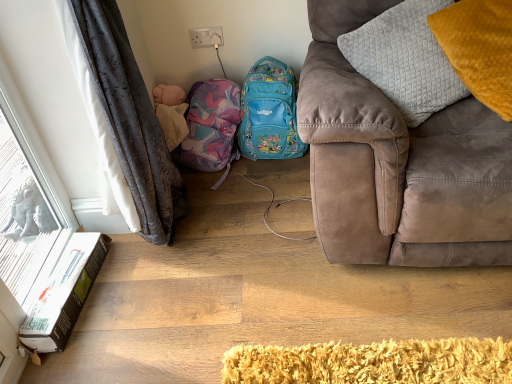
Where is `vacant area in front of white cardboard box at lower left`? The image size is (512, 384). vacant area in front of white cardboard box at lower left is located at coordinates (87, 348).